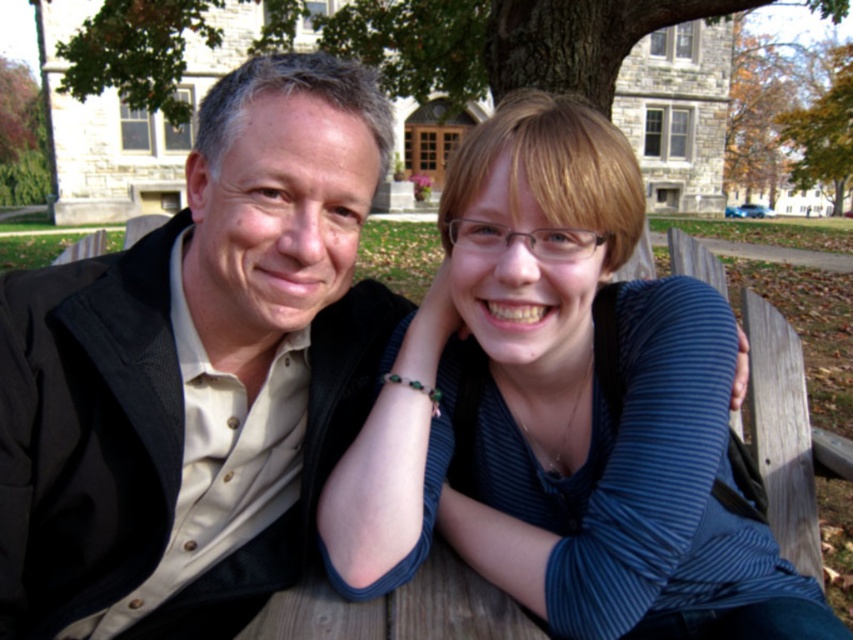
You are a photographer trying to capture a closeup of the blue striped shirt at center without including the matte black jacket at left in the frame. Given their sizes, is this possible?

The matte black jacket at left has a larger size compared to blue striped shirt at center. Since the jacket is larger, it might be challenging to frame the blue striped shirt at center without including the jacket unless the photographer moves closer to focus on the shirt.

You are a photographer trying to capture a clear shot of the matte black jacket at left and the blue striped shirt at center. Since you want to focus on the jacket, which object should you adjust your camera to prioritize in terms of depth of field?

The matte black jacket at left is above the blue striped shirt at center, so to prioritize the jacket in the depth of field, adjust the camera focus to the upper area where the matte black jacket at left is located.

You are a photographer standing 3 feet away from the two people. You want to take a photo of the matte black jacket at left and the blue striped shirt at center. Can you fit both into your camera frame if the maximum width your camera can capture is 30 inches?

The distance between the matte black jacket at left and the blue striped shirt at center is 28.02 inches, which is less than the camera frame width of 30 inches. Therefore, both can be captured in the same frame.